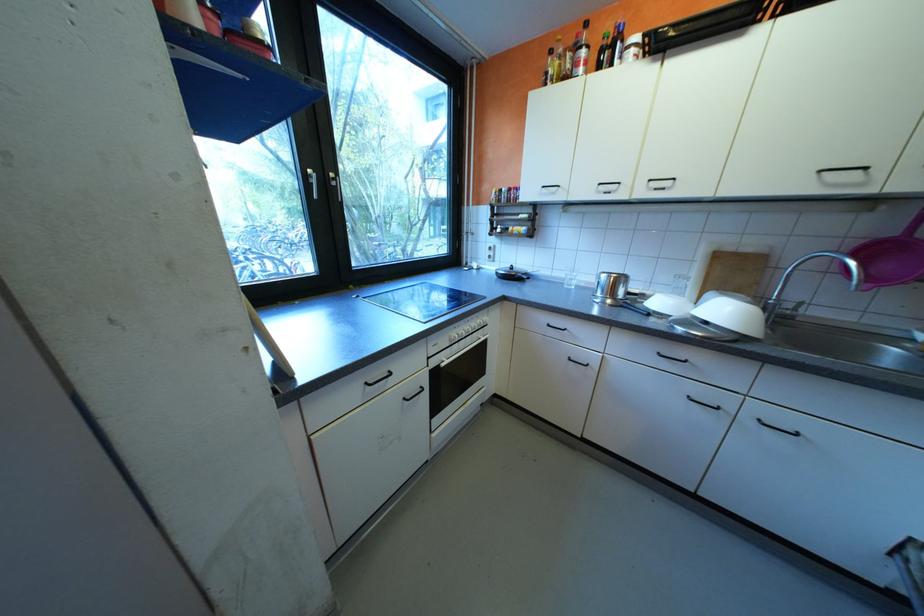
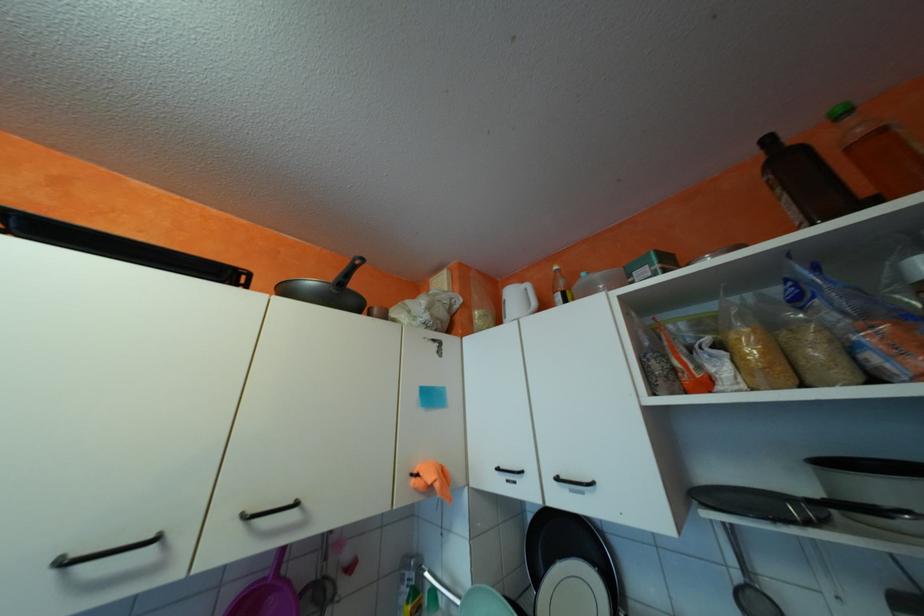
The first image is from the beginning of the video and the second image is from the end. How did the camera likely rotate when shooting the video?

The camera's rotation is toward right-up.